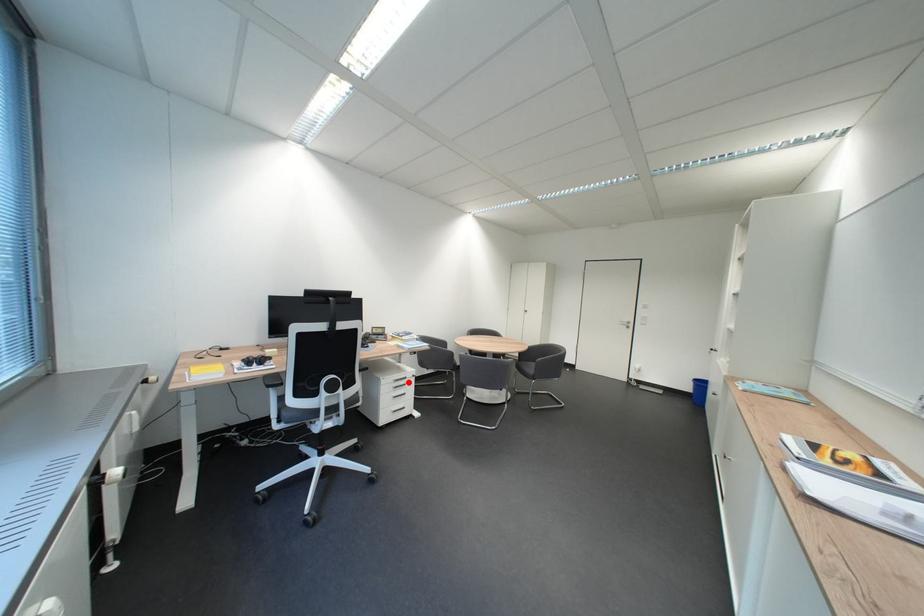
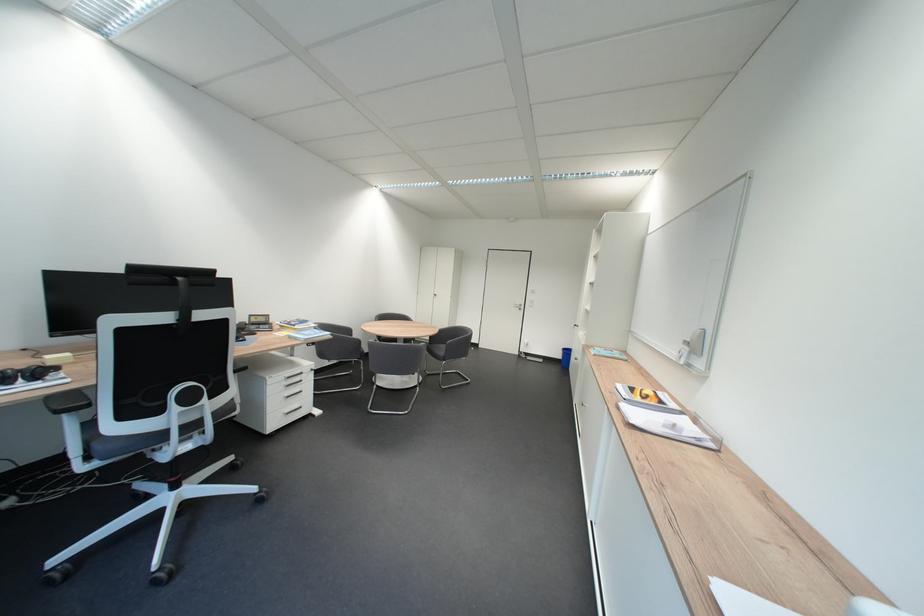
Question: I am providing you with two images of the same scene from different viewpoints. In image1, a red point is highlighted. Considering the same 3D point in image2, which of the following is correct?

Choices:
 (A) It is closer
 (B) It is farther

Answer: (A)